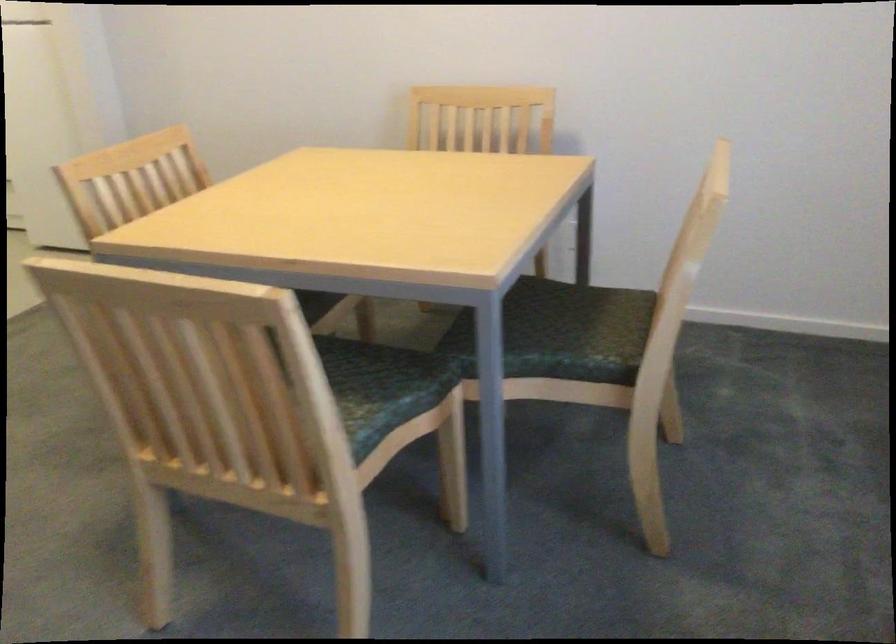
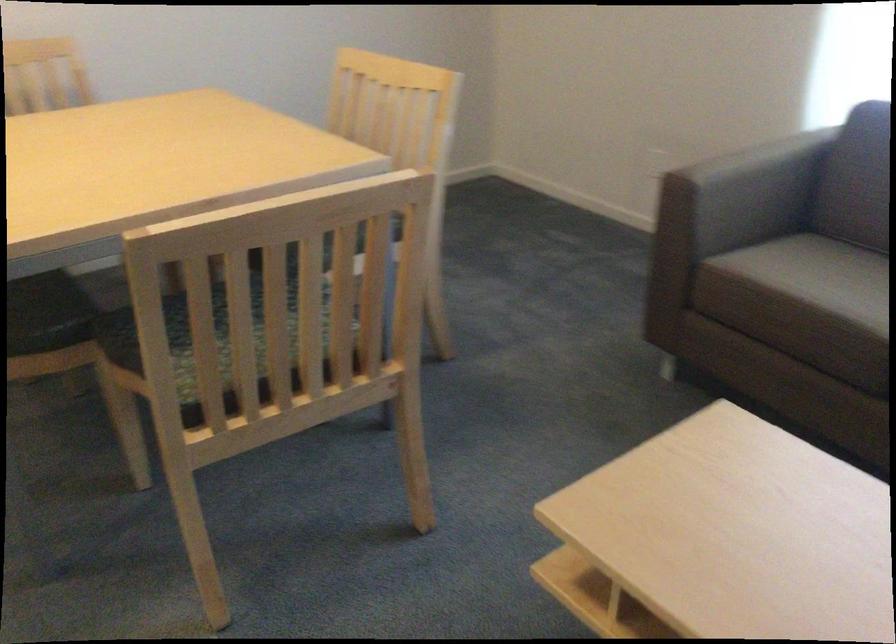
In the second image, find the point that corresponds to point (131, 372) in the first image.

(211, 334)